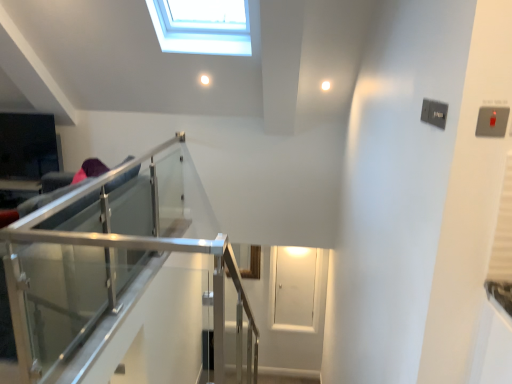
This screenshot has width=512, height=384. Describe the element at coordinates (295, 287) in the screenshot. I see `transparent glass door at center` at that location.

Where is `transparent glass door at center`? The width and height of the screenshot is (512, 384). transparent glass door at center is located at coordinates (295, 287).

Locate an element on the screen. This screenshot has height=384, width=512. clear glass railing at left is located at coordinates [x=105, y=270].

The width and height of the screenshot is (512, 384). What do you see at coordinates (105, 270) in the screenshot? I see `clear glass railing at left` at bounding box center [105, 270].

This screenshot has width=512, height=384. I want to click on transparent glass door at center, so pos(295,287).

Which is more to the left, clear glass railing at left or transparent glass door at center?

clear glass railing at left.

Is the depth of clear glass railing at left less than that of transparent glass door at center?

Yes, it is in front of transparent glass door at center.

Which point is more forward, (153, 276) or (303, 258)?

The point (153, 276) is in front.

From the image's perspective, which is below, clear glass railing at left or transparent glass door at center?

transparent glass door at center, from the image's perspective.

From a real-world perspective, is clear glass railing at left on transparent glass door at center?

Indeed, from a real-world perspective, clear glass railing at left stands above transparent glass door at center.

Which of these two, clear glass railing at left or transparent glass door at center, is thinner?

transparent glass door at center is thinner.

Is clear glass railing at left shorter than transparent glass door at center?

No.

Does clear glass railing at left have a larger size compared to transparent glass door at center?

Yes, clear glass railing at left is bigger than transparent glass door at center.

Is clear glass railing at left positioned beyond the bounds of transparent glass door at center?

Yes.

Looking at this image, are clear glass railing at left and transparent glass door at center located far from each other?

Indeed, clear glass railing at left is not near transparent glass door at center.

Is clear glass railing at left positioned with its back to transparent glass door at center?

That's not correct — clear glass railing at left is not looking away from transparent glass door at center.

Can you tell me how much clear glass railing at left and transparent glass door at center differ in facing direction?

The angular difference between clear glass railing at left and transparent glass door at center is 88.6 degrees.

I want to click on balcony that appears above the transparent glass door at center (from a real-world perspective), so click(105, 270).

Does transparent glass door at center appear on the left side of clear glass railing at left?

Incorrect, transparent glass door at center is not on the left side of clear glass railing at left.

Is the position of transparent glass door at center less distant than that of clear glass railing at left?

No, it is behind clear glass railing at left.

Does point (301, 286) come closer to viewer compared to point (124, 211)?

No, it is not.

From the image's perspective, is transparent glass door at center on top of clear glass railing at left?

Incorrect, from the image's perspective, transparent glass door at center is lower than clear glass railing at left.

From a real-world perspective, between transparent glass door at center and clear glass railing at left, who is vertically lower?

From a 3D spatial view, transparent glass door at center is below.

Considering the relative sizes of transparent glass door at center and clear glass railing at left in the image provided, is transparent glass door at center wider than clear glass railing at left?

No.

Between transparent glass door at center and clear glass railing at left, which one has more height?

clear glass railing at left.

Who is bigger, transparent glass door at center or clear glass railing at left?

clear glass railing at left.

Would you say clear glass railing at left is part of transparent glass door at center's contents?

Actually, clear glass railing at left is outside transparent glass door at center.

Is transparent glass door at center positioned far away from clear glass railing at left?

Yes, transparent glass door at center and clear glass railing at left are quite far apart.

Is transparent glass door at center oriented towards clear glass railing at left?

No, transparent glass door at center is not oriented towards clear glass railing at left.

Measure the distance between transparent glass door at center and clear glass railing at left.

transparent glass door at center and clear glass railing at left are 8.89 feet apart.

Where is `glass door beneath the clear glass railing at left (from a real-world perspective)`? glass door beneath the clear glass railing at left (from a real-world perspective) is located at coordinates (295, 287).

The height and width of the screenshot is (384, 512). In the image, there is a transparent glass door at center. Find the location of `balcony above it (from the image's perspective)`. balcony above it (from the image's perspective) is located at coordinates (105, 270).

Where is `balcony positioned vertically above the transparent glass door at center (from a real-world perspective)`? Image resolution: width=512 pixels, height=384 pixels. balcony positioned vertically above the transparent glass door at center (from a real-world perspective) is located at coordinates (105, 270).